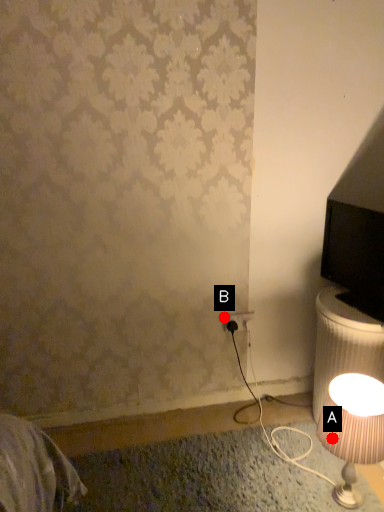
Question: Two points are circled on the image, labeled by A and B beside each circle. Which point appears closest to the camera in this image?

Choices:
 (A) A is closer
 (B) B is closer

Answer: (A)